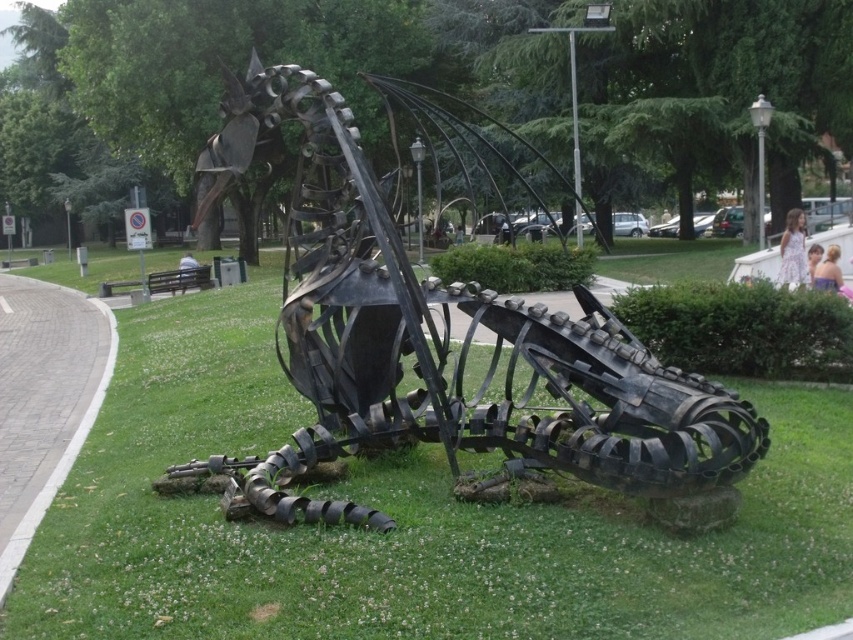
Is green grass at center to the right of metallic sculpture at center from the viewer's perspective?

In fact, green grass at center is to the left of metallic sculpture at center.

Between point (59, 614) and point (434, 280), which one is positioned behind?

Point (434, 280)

The width and height of the screenshot is (853, 640). I want to click on green grass at center, so click(x=405, y=520).

Find the location of a particular element. This screenshot has height=640, width=853. green grass at center is located at coordinates (405, 520).